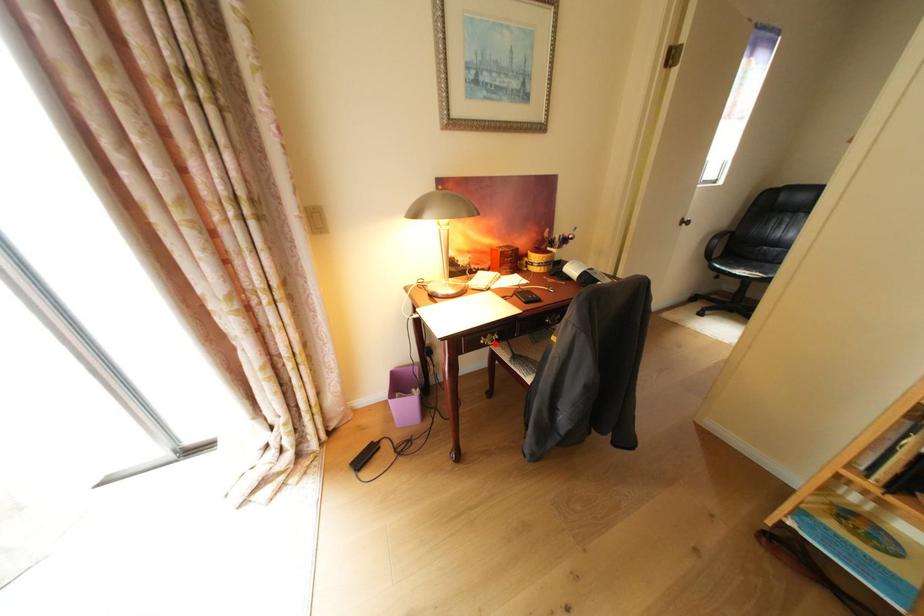
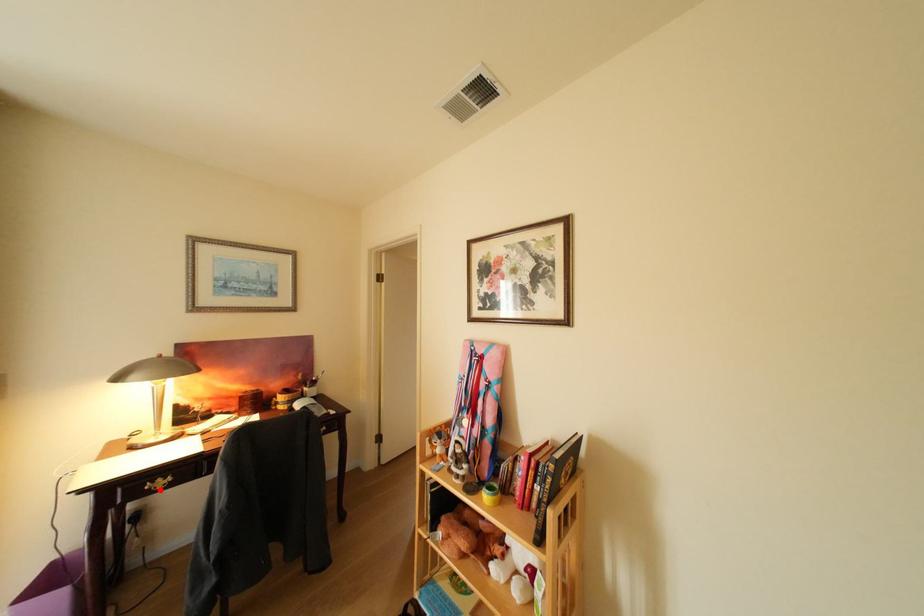
I am providing you with two images of the same scene from different viewpoints. A red point is marked on the first image and another point is marked on the second image. Are the points marked in image1 and image2 representing the same 3D position?

Yes